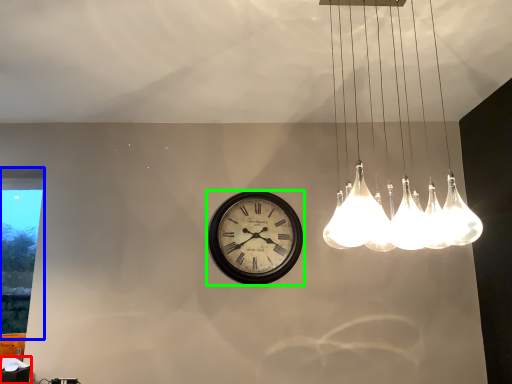
Question: Estimate the real-world distances between objects in this image. Which object is farther from table (highlighted by a red box), window (highlighted by a blue box) or wall clock (highlighted by a green box)?

Choices:
 (A) window
 (B) wall clock

Answer: (A)